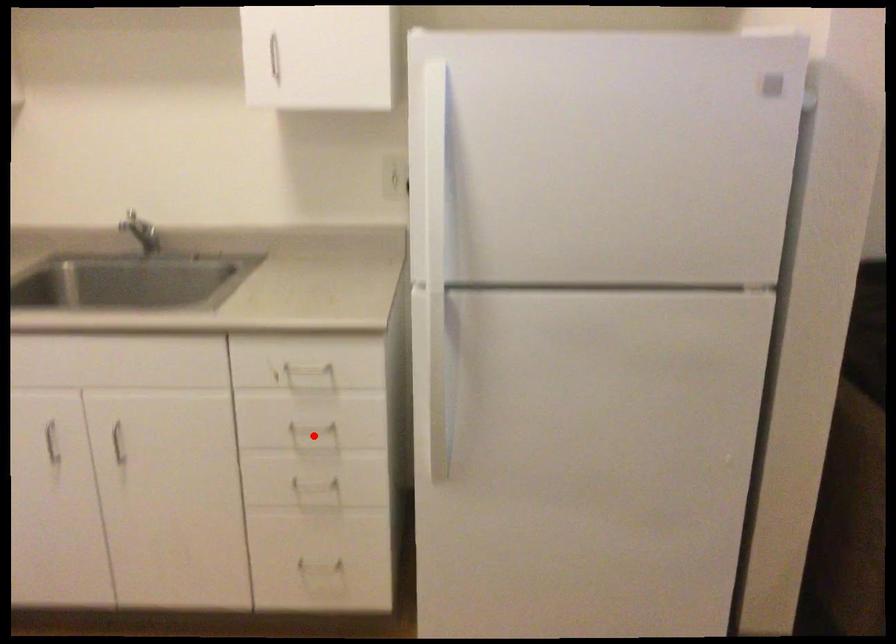
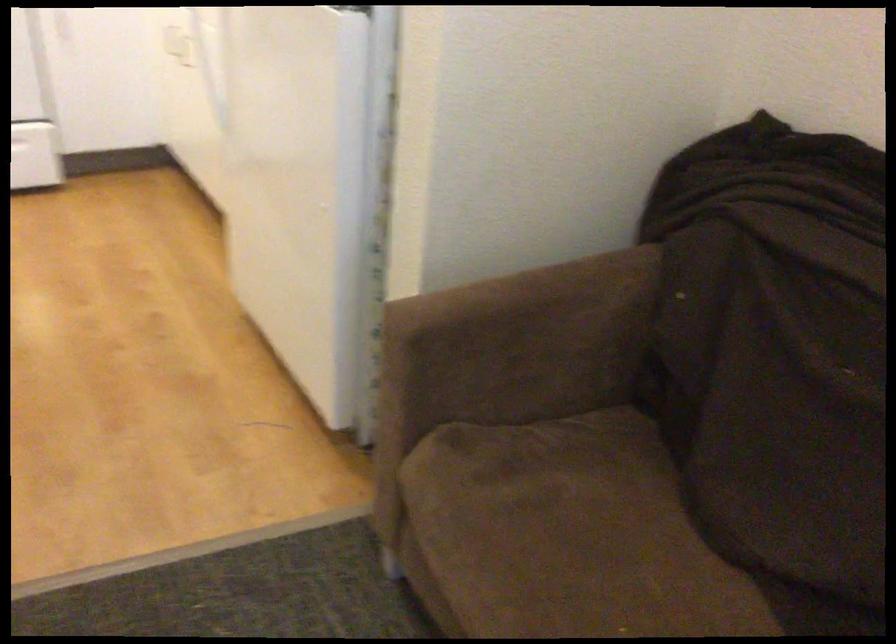
Question: I am providing you with two images of the same scene from different viewpoints. A red point is marked on the first image. Can you still see the location of the red point in image 2?

Choices:
 (A) Yes
 (B) No

Answer: (B)